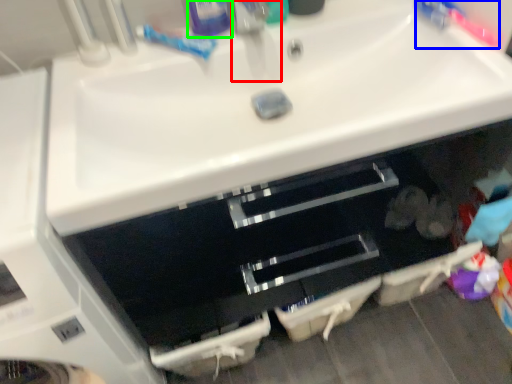
Question: Considering the real-world distances, which object is farthest from faucet (highlighted by a red box)? toothbrush (highlighted by a blue box) or toiletry (highlighted by a green box)?

Choices:
 (A) toothbrush
 (B) toiletry

Answer: (A)